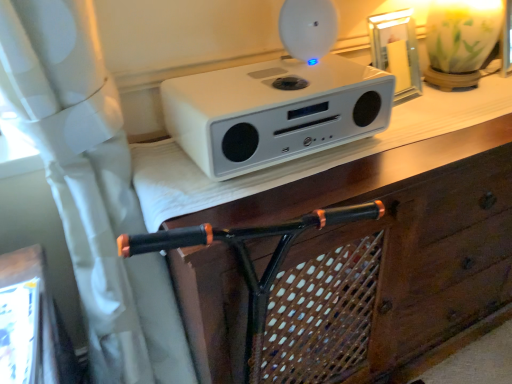
The height and width of the screenshot is (384, 512). What do you see at coordinates (279, 101) in the screenshot?
I see `white matte speaker at upper center` at bounding box center [279, 101].

Find the location of `white matte speaker at upper center`. white matte speaker at upper center is located at coordinates (279, 101).

Image resolution: width=512 pixels, height=384 pixels. Describe the element at coordinates (309, 156) in the screenshot. I see `white matte speaker at upper center` at that location.

What are the coordinates of `white matte speaker at upper center` in the screenshot? It's located at (309, 156).

Identify the location of white matte speaker at upper center. (279, 101).

Which object is positioned more to the right, white matte speaker at upper center or white matte speaker at upper center?

white matte speaker at upper center is more to the right.

Which object is more forward, white matte speaker at upper center or white matte speaker at upper center?

white matte speaker at upper center is in front.

Is point (139, 190) positioned before point (311, 139)?

That is True.

Based on the photo, from the image's perspective, between white matte speaker at upper center and white matte speaker at upper center, who is located below?

white matte speaker at upper center is shown below in the image.

From a real-world perspective, is white matte speaker at upper center positioned above or below white matte speaker at upper center?

From a real-world perspective, white matte speaker at upper center is physically below white matte speaker at upper center.

Consider the image. Which object is thinner, white matte speaker at upper center or white matte speaker at upper center?

Thinner between the two is white matte speaker at upper center.

Considering the relative sizes of white matte speaker at upper center and white matte speaker at upper center in the image provided, is white matte speaker at upper center taller than white matte speaker at upper center?

Correct, white matte speaker at upper center is much taller as white matte speaker at upper center.

Between white matte speaker at upper center and white matte speaker at upper center, which one has larger size?

white matte speaker at upper center.

Is white matte speaker at upper center not within white matte speaker at upper center?

Yes, white matte speaker at upper center is outside of white matte speaker at upper center.

Is white matte speaker at upper center touching white matte speaker at upper center?

No.

Is white matte speaker at upper center oriented towards white matte speaker at upper center?

No, white matte speaker at upper center is not turned towards white matte speaker at upper center.

From the picture: Can you tell me how much white matte speaker at upper center and white matte speaker at upper center differ in facing direction?

The facing directions of white matte speaker at upper center and white matte speaker at upper center are 0.918 degrees apart.

Consider the image. Measure the distance between white matte speaker at upper center and white matte speaker at upper center.

white matte speaker at upper center is 5.75 inches away from white matte speaker at upper center.

At what (x,y) coordinates should I click in order to perform the action: click on vanity in front of the white matte speaker at upper center. Please return your answer as a coordinate pair (x, y). The image size is (512, 384). Looking at the image, I should click on (309, 156).

Between white matte speaker at upper center and white matte speaker at upper center, which one appears on the right side from the viewer's perspective?

white matte speaker at upper center is more to the right.

Is the position of white matte speaker at upper center less distant than that of white matte speaker at upper center?

No.

Which point is more distant from viewer, [206,100] or [450,99]?

Point [450,99]

From the image's perspective, does white matte speaker at upper center appear higher than white matte speaker at upper center?

Yes, from the image's perspective, white matte speaker at upper center is above white matte speaker at upper center.

Based on the photo, from a real-world perspective, is white matte speaker at upper center below white matte speaker at upper center?

Incorrect, from a real-world perspective, white matte speaker at upper center is higher than white matte speaker at upper center.

Is white matte speaker at upper center thinner than white matte speaker at upper center?

Correct, the width of white matte speaker at upper center is less than that of white matte speaker at upper center.

Which of these two, white matte speaker at upper center or white matte speaker at upper center, stands shorter?

white matte speaker at upper center is shorter.

Considering the sizes of objects white matte speaker at upper center and white matte speaker at upper center in the image provided, who is bigger, white matte speaker at upper center or white matte speaker at upper center?

With larger size is white matte speaker at upper center.

Could white matte speaker at upper center be considered to be inside white matte speaker at upper center?

No.

Would you say white matte speaker at upper center is a long distance from white matte speaker at upper center?

They are positioned close to each other.

From the picture: Is white matte speaker at upper center positioned with its back to white matte speaker at upper center?

No, white matte speaker at upper center is not at the back of white matte speaker at upper center.

Based on the photo, how many degrees apart are the facing directions of white matte speaker at upper center and white matte speaker at upper center?

white matte speaker at upper center and white matte speaker at upper center are facing 0.918 degrees away from each other.

How distant is white matte speaker at upper center from white matte speaker at upper center?

white matte speaker at upper center is 14.60 centimeters from white matte speaker at upper center.

This screenshot has height=384, width=512. Identify the location of home appliance above the white matte speaker at upper center (from a real-world perspective). (279, 101).

Find the location of a particular element. This screenshot has width=512, height=384. home appliance that is behind the white matte speaker at upper center is located at coordinates (279, 101).

The image size is (512, 384). I want to click on home appliance on the left of the white matte speaker at upper center, so (x=279, y=101).